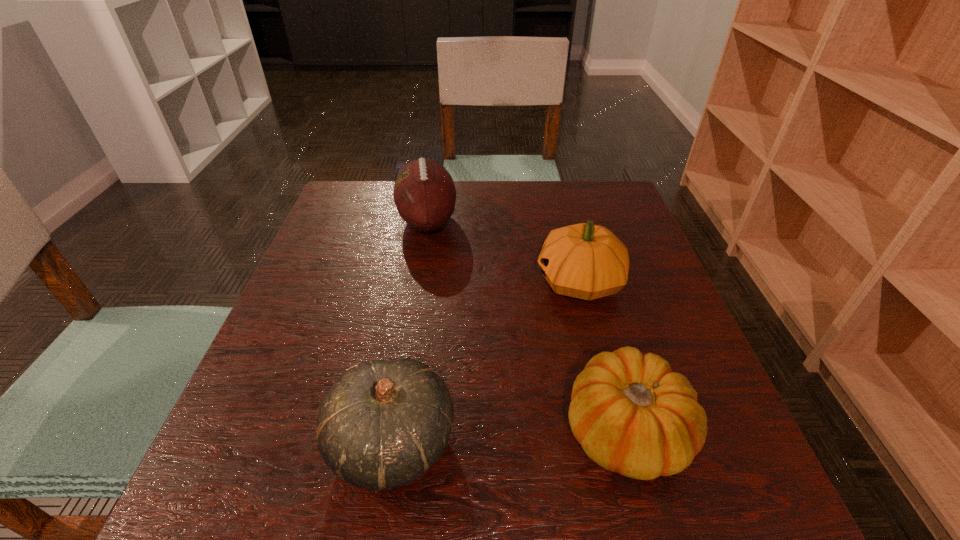
Where is `football (American)`? The image size is (960, 540). football (American) is located at coordinates (424, 192).

Locate an element on the screen. the third nearest object is located at coordinates click(x=586, y=261).

Locate an element on the screen. The height and width of the screenshot is (540, 960). the leftmost gourd is located at coordinates (383, 423).

What are the coordinates of `the shortest object` in the screenshot? It's located at (633, 415).

You are a GUI agent. You are given a task and a screenshot of the screen. Output one action in this format:
    pyautogui.click(x=<x>, y=<y>)
    Task: Click on the free space located 0.080m on the right of the football (American)
    The height and width of the screenshot is (540, 960).
    Given the screenshot: What is the action you would take?
    coord(488,220)

Locate an element on the screen. vacant position located 0.150m on the side of the second farthest object with the carved face is located at coordinates [x=468, y=282].

Image resolution: width=960 pixels, height=540 pixels. In order to click on blank space located on the side of the second farthest object with the carved face in this screenshot , I will do `click(472, 282)`.

The image size is (960, 540). I want to click on vacant area located 0.140m on the side of the second farthest object with the carved face, so click(472, 282).

The width and height of the screenshot is (960, 540). In order to click on free point located on the back of the leftmost gourd in this screenshot , I will do `click(421, 260)`.

Find the location of a particular element. The height and width of the screenshot is (540, 960). free location located on the left of the shortest gourd is located at coordinates (341, 431).